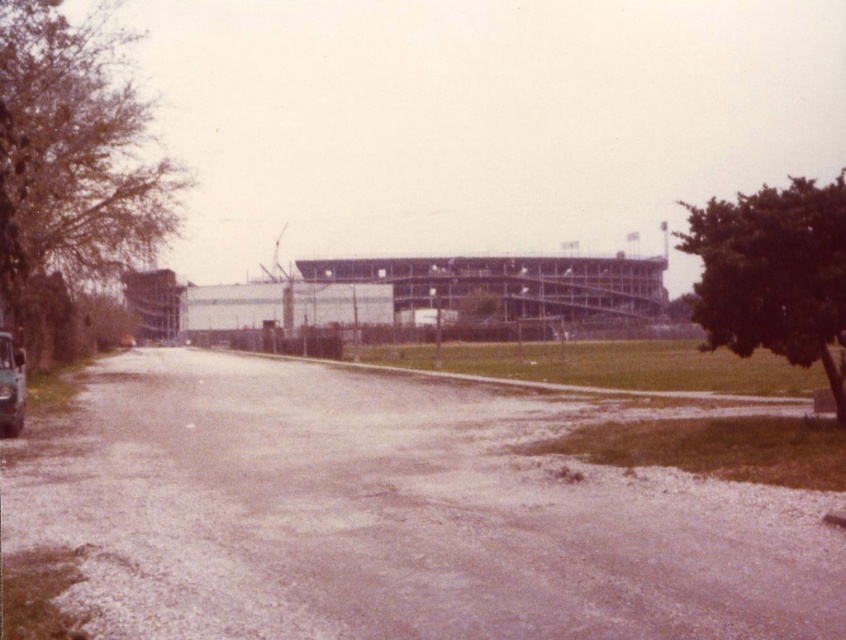
You are a delivery person who needs to park your shiny metallic car at left near the brown gravel road at center. Can you fit your car there without overlapping the road?

The brown gravel road at center is shorter than the shiny metallic car at left, so it may not provide enough space to park the car without overlapping the road.

You are standing on the dirt road with patches of grass and a partial view of a vehicle on the left side. You want to walk to the white building structure in the background. According to the image, where is the brown gravel road at center located in relation to your current position?

The brown gravel road at center is located at point (396, 516) in the image, so you should head towards that coordinate to reach the white building structure in the background.